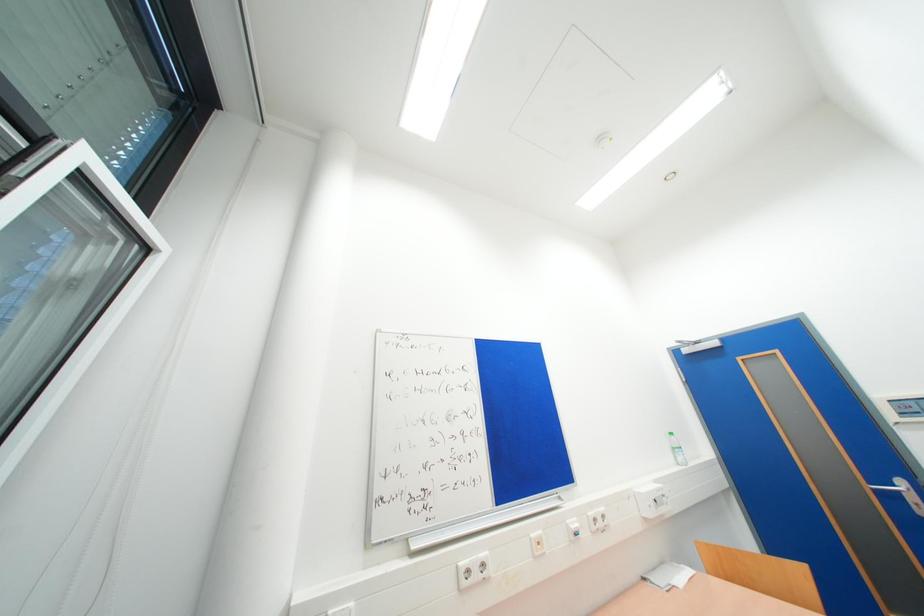
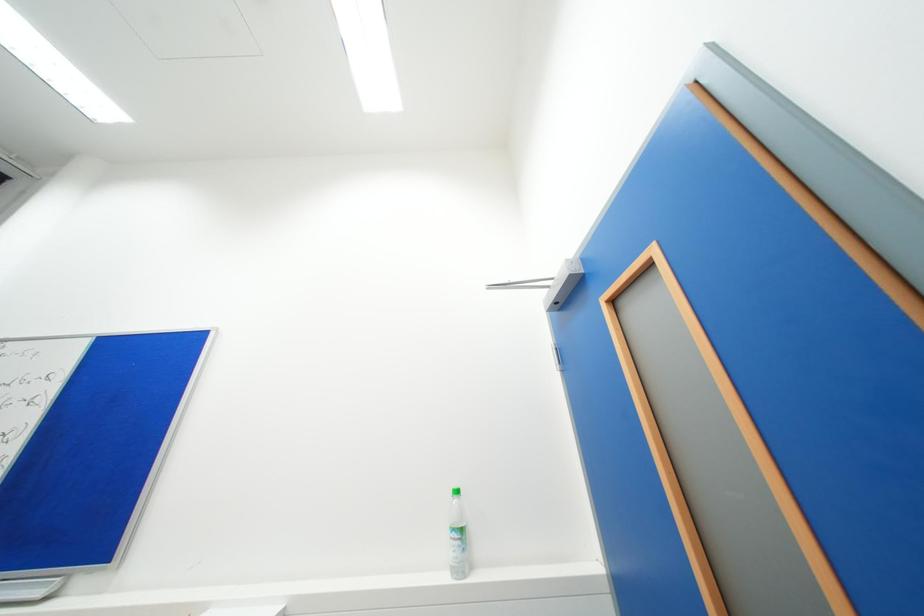
Looking at this image, which direction would the cameraman need to move to produce the second image?

The cameraman walked toward right, forward.